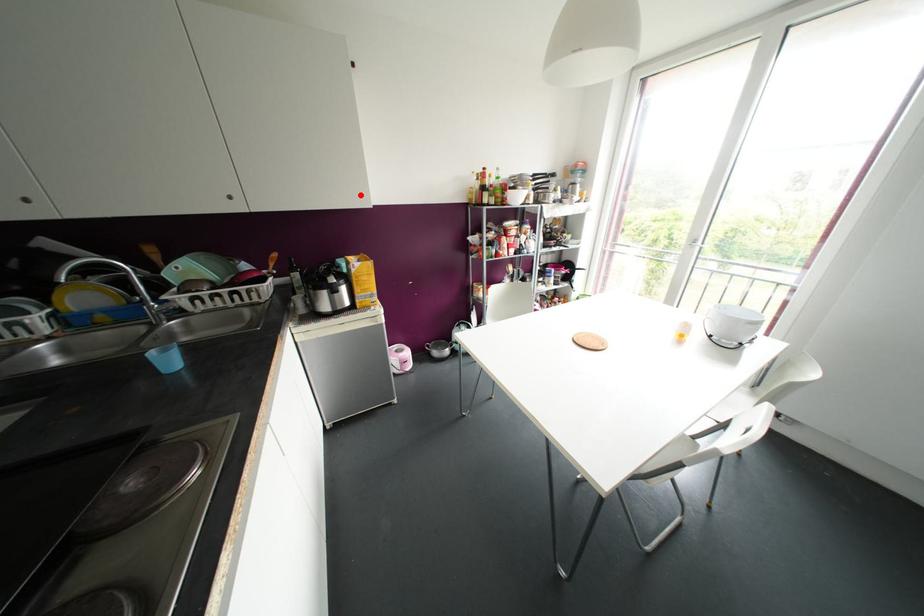
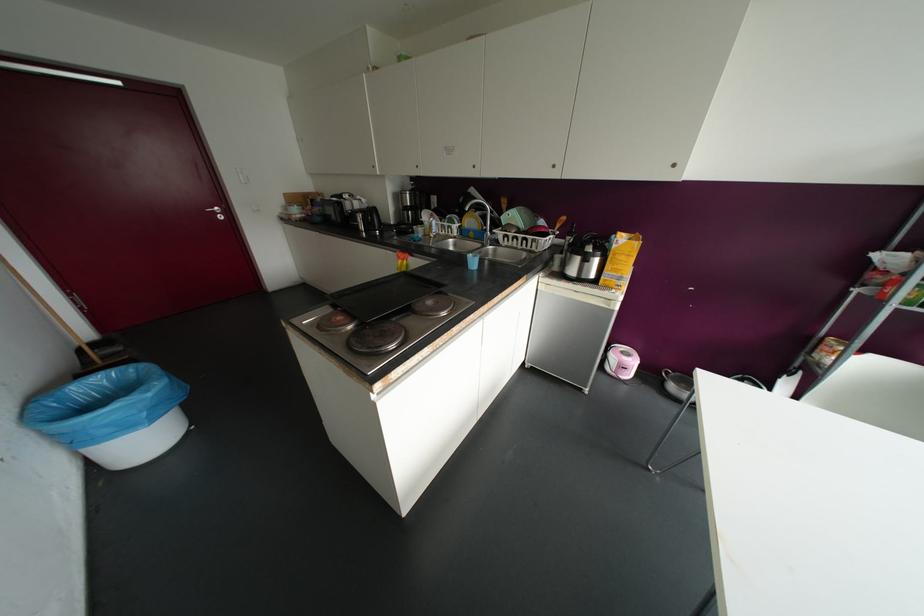
Find the pixel in the second image that matches the highlighted location in the first image.

(673, 164)